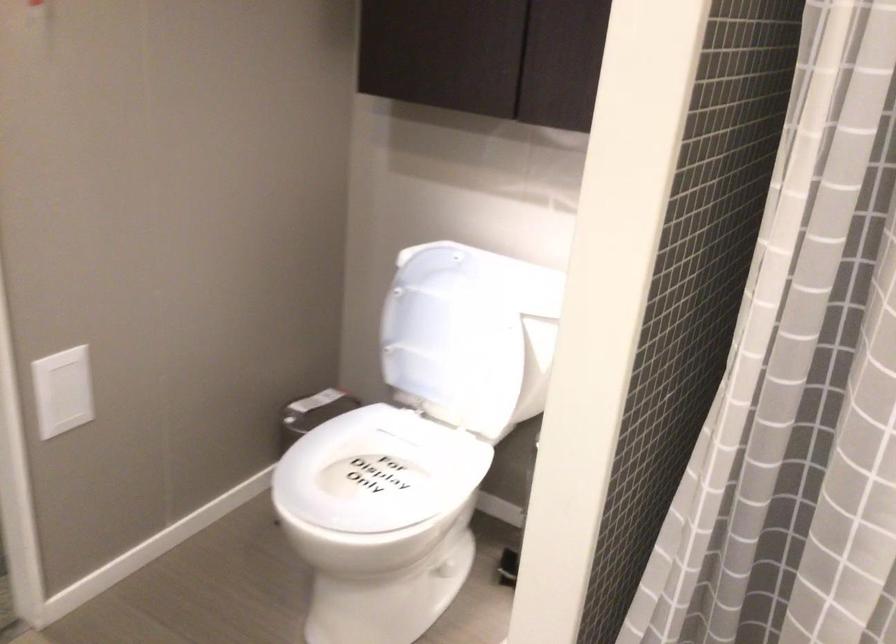
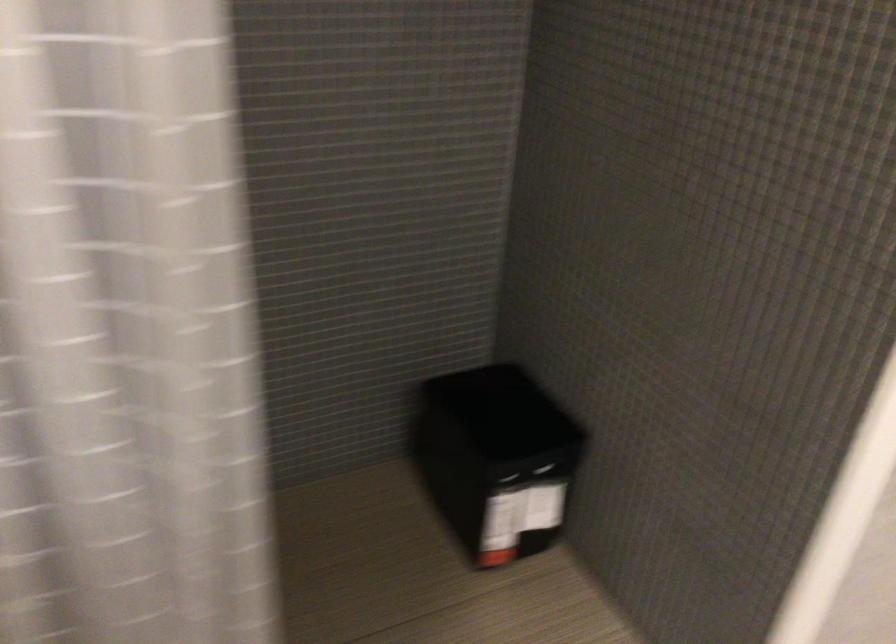
Based on the continuous images, in which direction is the camera rotating?

The camera rotated toward right-down.